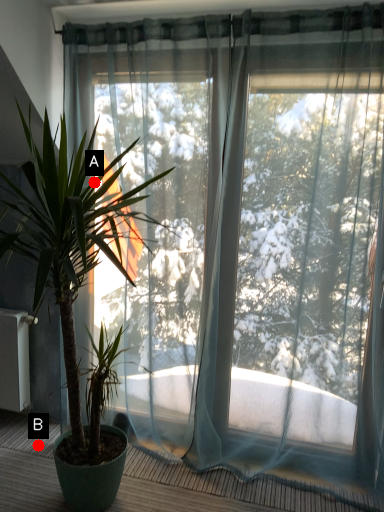
Question: Two points are circled on the image, labeled by A and B beside each circle. Which point is closer to the camera?

Choices:
 (A) A is closer
 (B) B is closer

Answer: (A)